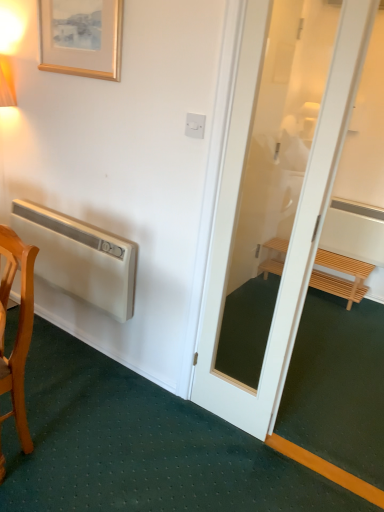
Question: Would you say white matte air conditioner at left is outside wooden framed print at upper left?

Choices:
 (A) no
 (B) yes

Answer: (B)

Question: Does white matte air conditioner at left have a greater height compared to wooden framed print at upper left?

Choices:
 (A) no
 (B) yes

Answer: (B)

Question: Is the position of white matte air conditioner at left more distant than that of wooden framed print at upper left?

Choices:
 (A) no
 (B) yes

Answer: (B)

Question: From a real-world perspective, is white matte air conditioner at left located higher than wooden framed print at upper left?

Choices:
 (A) yes
 (B) no

Answer: (B)

Question: Is the position of white matte air conditioner at left less distant than that of wooden framed print at upper left?

Choices:
 (A) yes
 (B) no

Answer: (B)

Question: Is white matte air conditioner at left aimed at wooden framed print at upper left?

Choices:
 (A) yes
 (B) no

Answer: (B)

Question: Can you confirm if white matte air conditioner at left is smaller than light brown wooden bench at right?

Choices:
 (A) no
 (B) yes

Answer: (B)

Question: From a real-world perspective, is white matte air conditioner at left located beneath light brown wooden bench at right?

Choices:
 (A) yes
 (B) no

Answer: (B)

Question: Is white matte air conditioner at left next to light brown wooden bench at right and touching it?

Choices:
 (A) yes
 (B) no

Answer: (B)

Question: Is light brown wooden bench at right inside white matte air conditioner at left?

Choices:
 (A) no
 (B) yes

Answer: (A)

Question: Does white matte air conditioner at left lie behind light brown wooden bench at right?

Choices:
 (A) no
 (B) yes

Answer: (A)

Question: Can you confirm if white matte air conditioner at left is bigger than light brown wooden bench at right?

Choices:
 (A) yes
 (B) no

Answer: (B)

Question: Is wooden framed print at upper left taller than light brown wooden bench at right?

Choices:
 (A) yes
 (B) no

Answer: (A)